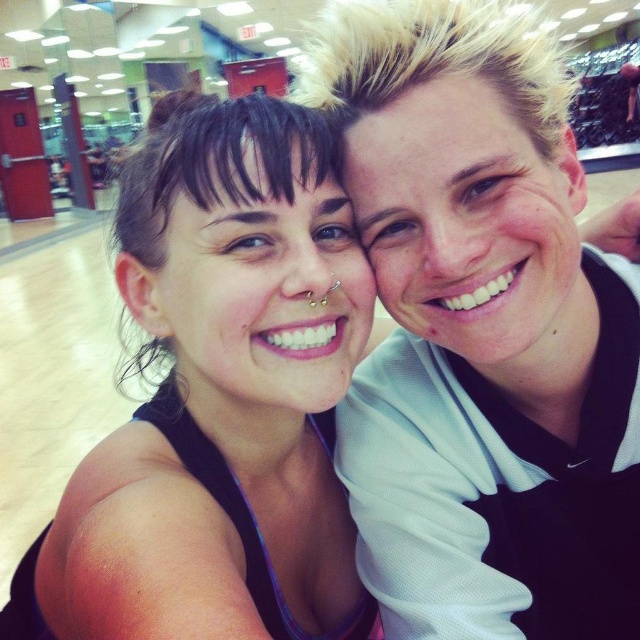
Question: Does black mesh shirt at upper right appear over black matte tank top at center?

Choices:
 (A) no
 (B) yes

Answer: (B)

Question: Which point is farther from the camera taking this photo?

Choices:
 (A) (243, 516)
 (B) (394, 218)

Answer: (A)

Question: Is black mesh shirt at upper right positioned in front of black matte tank top at center?

Choices:
 (A) no
 (B) yes

Answer: (A)

Question: Is black mesh shirt at upper right below black matte tank top at center?

Choices:
 (A) yes
 (B) no

Answer: (B)

Question: Which point is closer to the camera?

Choices:
 (A) black matte tank top at center
 (B) black mesh shirt at upper right

Answer: (A)